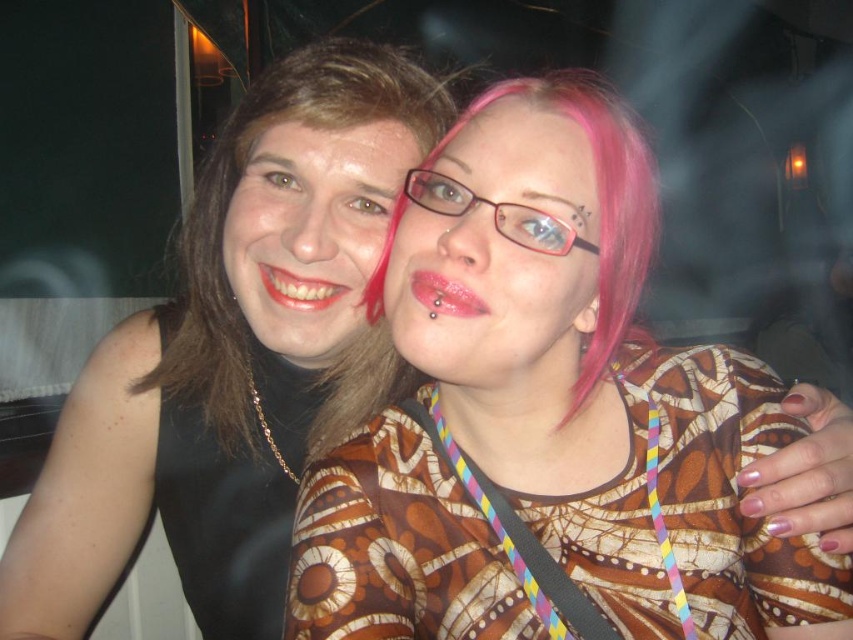
Which is more to the left, shiny white lipstick at center or shiny pink lipstick at center?

Positioned to the left is shiny white lipstick at center.

Does shiny white lipstick at center appear on the right side of shiny pink lipstick at center?

In fact, shiny white lipstick at center is to the left of shiny pink lipstick at center.

Is point (259, 266) positioned behind point (410, 282)?

That is True.

In order to click on shiny white lipstick at center in this screenshot , I will do `click(299, 289)`.

Does point (386, 634) lie in front of point (318, 278)?

Yes, point (386, 634) is in front of point (318, 278).

Is matte black dress at center shorter than shiny white lipstick at center?

Incorrect, matte black dress at center's height does not fall short of shiny white lipstick at center's.

Locate an element on the screen. The width and height of the screenshot is (853, 640). matte black dress at center is located at coordinates (550, 417).

Between point (148, 340) and point (432, 291), which one is positioned in front?

Point (432, 291)

Which of these two, matte black dress at left or shiny pink lipstick at center, stands shorter?

With less height is shiny pink lipstick at center.

What do you see at coordinates (233, 356) in the screenshot? This screenshot has height=640, width=853. I see `matte black dress at left` at bounding box center [233, 356].

Where is `matte black dress at left`? The height and width of the screenshot is (640, 853). matte black dress at left is located at coordinates tap(233, 356).